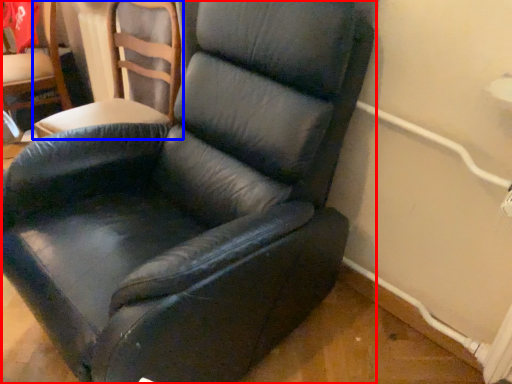
Question: Among these objects, which one is farthest to the camera, chair (highlighted by a red box) or chair (highlighted by a blue box)?

Choices:
 (A) chair
 (B) chair

Answer: (B)